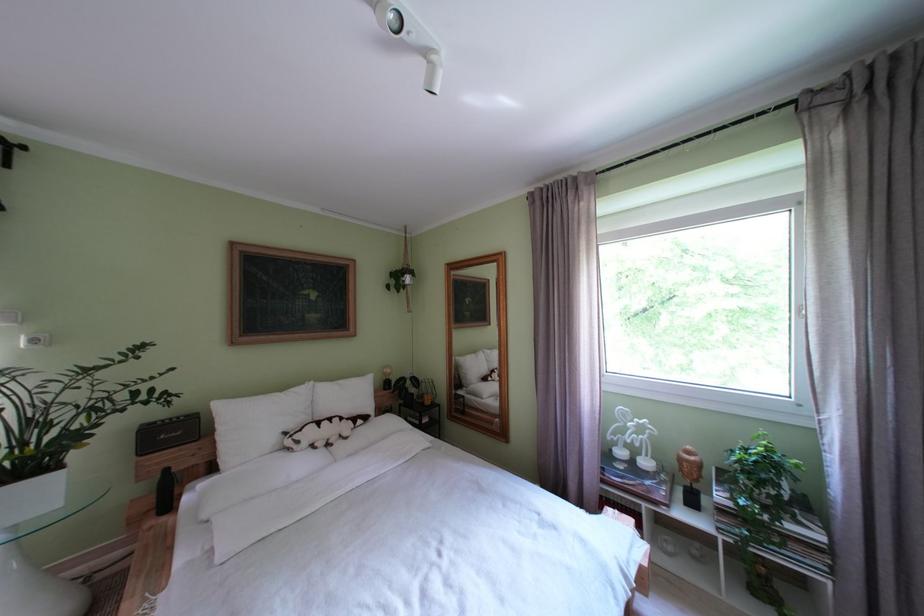
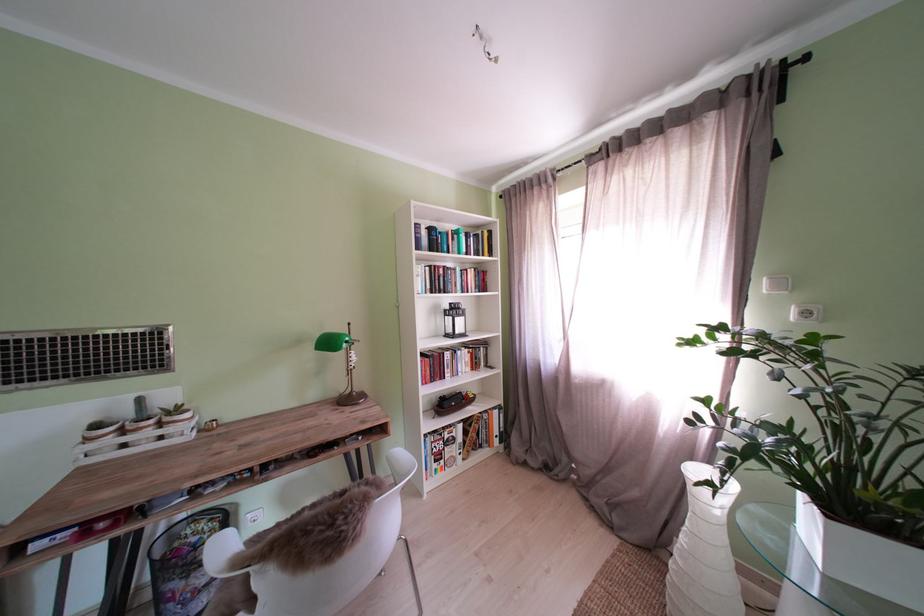
Locate, in the second image, the point that corresponds to (83,419) in the first image.

(909, 446)